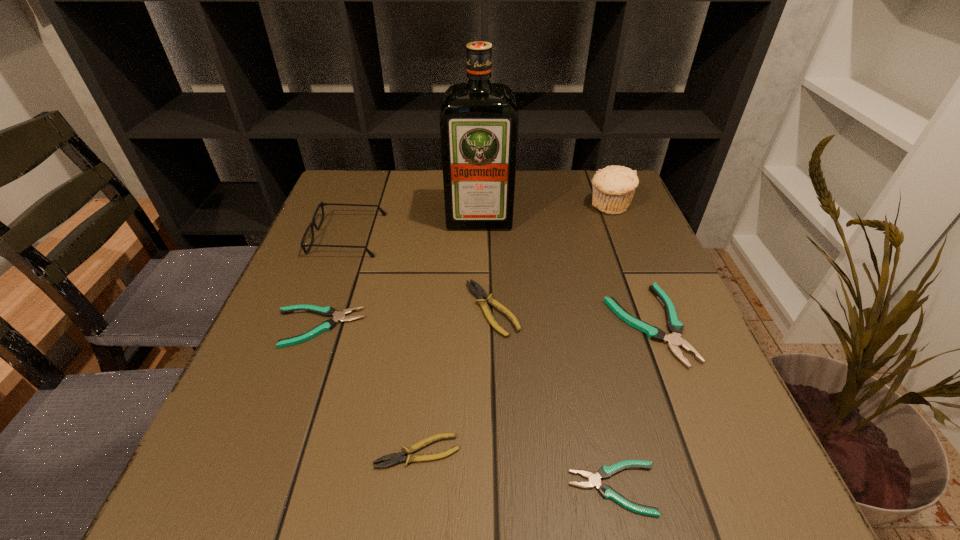
What are the coordinates of `free region located 0.070m on the back of the shortest object` in the screenshot? It's located at (598, 419).

The width and height of the screenshot is (960, 540). I want to click on liquor located at the far edge, so click(x=479, y=121).

Where is `muffin that is at the far edge`? The height and width of the screenshot is (540, 960). muffin that is at the far edge is located at coordinates pyautogui.click(x=613, y=186).

Find the location of a particular element. spectacles that is at the far edge is located at coordinates (313, 224).

In order to click on spectacles present at the left edge in this screenshot , I will do `click(313, 224)`.

I want to click on pliers at the left edge, so 327,311.

Locate an element on the screen. Image resolution: width=960 pixels, height=540 pixels. muffin present at the right edge is located at coordinates (613, 186).

You are a GUI agent. You are given a task and a screenshot of the screen. Output one action in this format:
    pyautogui.click(x=<x>, y=<y>)
    Task: Click on the object located at the far left corner
    The width and height of the screenshot is (960, 540).
    Given the screenshot: What is the action you would take?
    pyautogui.click(x=313, y=224)

Locate an element on the screen. This screenshot has height=540, width=960. object located at the far right corner is located at coordinates (613, 186).

Locate an element on the screen. The image size is (960, 540). object present at the near right corner is located at coordinates (594, 480).